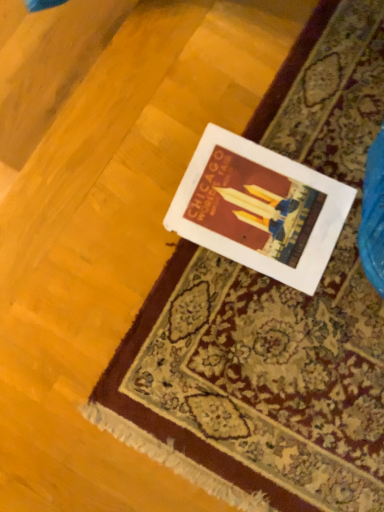
Measure the distance between matte paper book at center and camera.

matte paper book at center is 28.96 inches from camera.

What is the approximate height of matte paper book at center?

1.53 centimeters.

Locate an element on the screen. matte paper book at center is located at coordinates (260, 209).

Image resolution: width=384 pixels, height=512 pixels. What do you see at coordinates (260, 209) in the screenshot?
I see `matte paper book at center` at bounding box center [260, 209].

Identify the location of matte paper book at center. (260, 209).